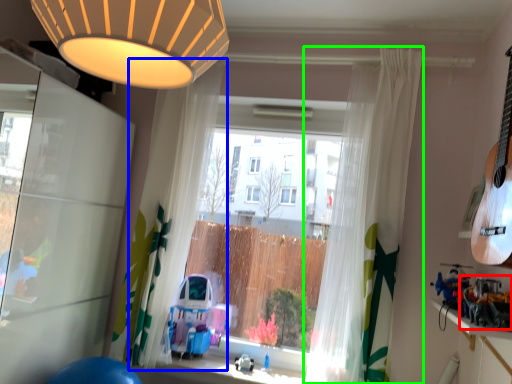
Question: Which is farther away from toy (highlighted by a red box)? curtain (highlighted by a blue box) or curtain (highlighted by a green box)?

Choices:
 (A) curtain
 (B) curtain

Answer: (A)